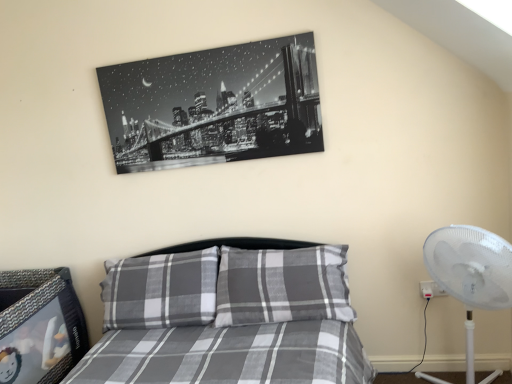
Question: Is gray plaid bed at center further to camera compared to white plastic fan at right?

Choices:
 (A) no
 (B) yes

Answer: (A)

Question: From the image's perspective, is gray plaid bed at center on top of white plastic fan at right?

Choices:
 (A) yes
 (B) no

Answer: (B)

Question: From a real-world perspective, does gray plaid bed at center stand above white plastic fan at right?

Choices:
 (A) yes
 (B) no

Answer: (B)

Question: From the image's perspective, does gray plaid bed at center appear lower than white plastic fan at right?

Choices:
 (A) no
 (B) yes

Answer: (B)

Question: Considering the relative positions of gray plaid bed at center and white plastic fan at right in the image provided, is gray plaid bed at center to the left of white plastic fan at right from the viewer's perspective?

Choices:
 (A) no
 (B) yes

Answer: (B)

Question: In terms of size, does black glossy print at upper center appear bigger or smaller than gray plaid bed at center?

Choices:
 (A) small
 (B) big

Answer: (A)

Question: Is black glossy print at upper center wider or thinner than gray plaid bed at center?

Choices:
 (A) thin
 (B) wide

Answer: (A)

Question: Considering the positions of point (178, 147) and point (259, 279), is point (178, 147) closer or farther from the camera than point (259, 279)?

Choices:
 (A) closer
 (B) farther

Answer: (B)

Question: Is black glossy print at upper center to the left or to the right of gray plaid bed at center in the image?

Choices:
 (A) left
 (B) right

Answer: (A)

Question: Is gray plaid bed at center situated inside white plastic fan at right or outside?

Choices:
 (A) outside
 (B) inside

Answer: (A)

Question: From a real-world perspective, is gray plaid bed at center physically located above or below white plastic fan at right?

Choices:
 (A) below
 (B) above

Answer: (A)

Question: Is gray plaid bed at center taller or shorter than white plastic fan at right?

Choices:
 (A) short
 (B) tall

Answer: (A)

Question: Based on their sizes in the image, would you say gray plaid bed at center is bigger or smaller than white plastic fan at right?

Choices:
 (A) small
 (B) big

Answer: (B)

Question: Choose the correct answer: Is white plastic fan at right inside gray plaid bed at center or outside it?

Choices:
 (A) outside
 (B) inside

Answer: (A)

Question: From a real-world perspective, is white plastic fan at right above or below gray plaid bed at center?

Choices:
 (A) below
 (B) above

Answer: (B)